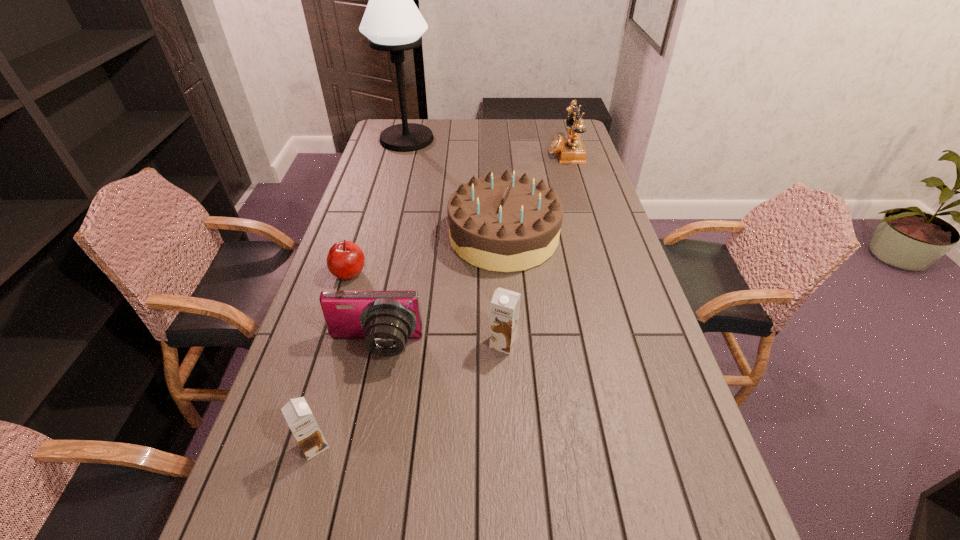
The image size is (960, 540). Find the location of `the left chocolate milk`. the left chocolate milk is located at coordinates (297, 413).

This screenshot has height=540, width=960. What are the coordinates of `the shorter chocolate milk` in the screenshot? It's located at pos(297,413).

Image resolution: width=960 pixels, height=540 pixels. I want to click on the right chocolate milk, so click(x=505, y=304).

The height and width of the screenshot is (540, 960). I want to click on the farther chocolate milk, so click(x=505, y=304).

Locate an element on the screen. Image resolution: width=960 pixels, height=540 pixels. table lamp is located at coordinates (392, 22).

Where is `telephone`? The image size is (960, 540). telephone is located at coordinates (569, 151).

Image resolution: width=960 pixels, height=540 pixels. I want to click on birthday cake, so click(x=504, y=223).

This screenshot has height=540, width=960. I want to click on apple, so click(345, 260).

Where is `camera`? camera is located at coordinates [x=385, y=319].

Find the location of a particular element. free space located 0.250m on the right of the nearer chocolate milk is located at coordinates (449, 446).